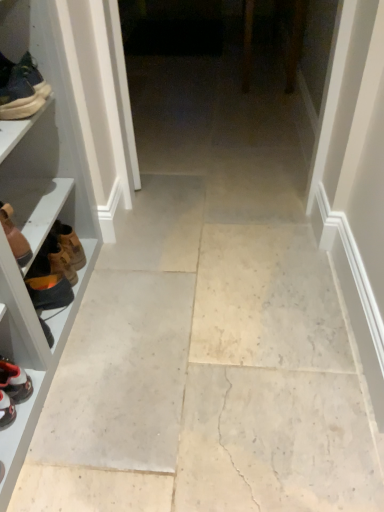
Question: Does orange suede boot at left, which is the second footwear in bottom-to-top order, have a smaller size compared to brown leather shoe at left?

Choices:
 (A) no
 (B) yes

Answer: (B)

Question: Is orange suede boot at left, which is the second footwear in bottom-to-top order, next to brown leather shoe at left and touching it?

Choices:
 (A) no
 (B) yes

Answer: (B)

Question: Is orange suede boot at left, the third footwear from the top, further to the viewer compared to brown leather shoe at left?

Choices:
 (A) no
 (B) yes

Answer: (A)

Question: From a real-world perspective, is orange suede boot at left, the third footwear from the top, over brown leather shoe at left?

Choices:
 (A) no
 (B) yes

Answer: (A)

Question: Is orange suede boot at left, the third footwear from the top, bigger than brown leather shoe at left?

Choices:
 (A) yes
 (B) no

Answer: (B)

Question: Is orange suede boot at left, which is the second footwear in bottom-to-top order, positioned before brown leather shoe at left?

Choices:
 (A) no
 (B) yes

Answer: (B)

Question: Can you see brown leather shoe at left touching brown leather boot at left, the 3th footwear ordered from the bottom?

Choices:
 (A) yes
 (B) no

Answer: (B)

Question: Is brown leather shoe at left taller than brown leather boot at left, the 3th footwear ordered from the bottom?

Choices:
 (A) no
 (B) yes

Answer: (A)

Question: Is brown leather shoe at left positioned behind brown leather boot at left, the second footwear from the top?

Choices:
 (A) yes
 (B) no

Answer: (A)

Question: Could brown leather boot at left, the second footwear from the top, be considered to be inside brown leather shoe at left?

Choices:
 (A) no
 (B) yes

Answer: (A)

Question: Is brown leather shoe at left completely or partially outside of brown leather boot at left, the 3th footwear ordered from the bottom?

Choices:
 (A) no
 (B) yes

Answer: (B)

Question: Can you confirm if brown leather shoe at left is smaller than brown leather boot at left, the 3th footwear ordered from the bottom?

Choices:
 (A) no
 (B) yes

Answer: (B)

Question: Is orange suede boot at left, the third footwear from the top, far from brown leather boot at left, the 3th footwear ordered from the bottom?

Choices:
 (A) no
 (B) yes

Answer: (A)